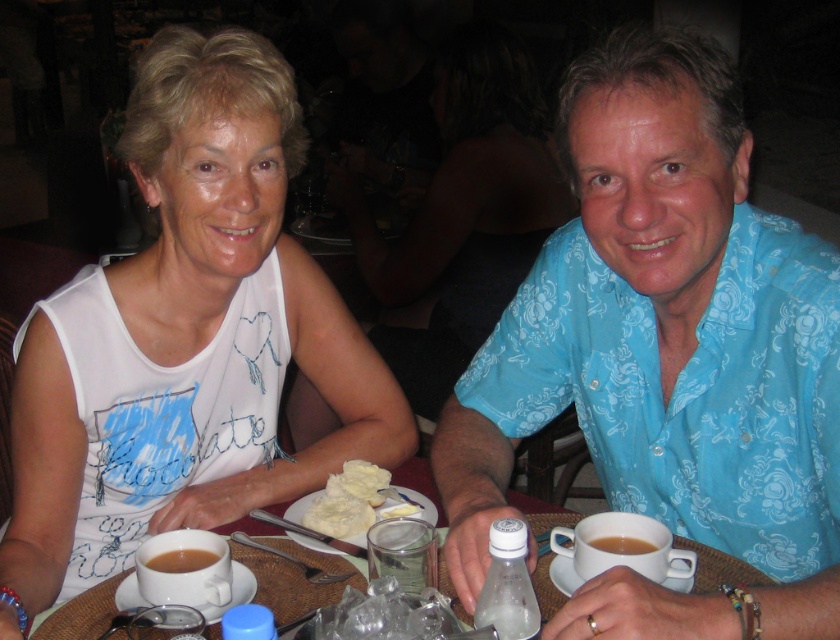
You are a food delivery person who needs to place a new order on the table. The new item must be placed between the white buttery bread at center and the clear glass jar at center. Which object should you place the new item closer to?

The new item should be placed closer to the clear glass jar at center because the white buttery bread at center is further to the viewer than the clear glass jar at center, meaning the jar is closer to you.

You are a waiter in a restaurant and need to place a 6.5 inch long dessert plate between the white buttery bread at center and the clear glass jar at center on the table. Can you fit it there without moving either item?

The distance between the white buttery bread at center and the clear glass jar at center is 7.37 inches. Since the dessert plate is 6.5 inches long, it can fit in the space between them as there is enough room.

You are a barista preparing a drink. You have a white matte tank top at center and a clear glass jar at center on the counter. Which item should you use to store milk for the next customer?

The clear glass jar at center is better for storing milk because the white matte tank top at center might be wider but it is likely not designed for food storage.